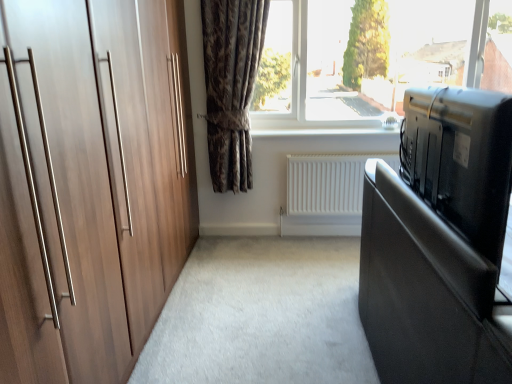
In order to click on black glossy tv at right in this screenshot , I will do `click(426, 293)`.

Find the location of `white matte radiator at center`. white matte radiator at center is located at coordinates (328, 183).

Find the location of a particular element. The width and height of the screenshot is (512, 384). black glossy tv at right is located at coordinates (426, 293).

Is dark brown textured curtain at center positioned behind white matte radiator at center?

That is False.

From a real-world perspective, is dark brown textured curtain at center on top of white matte radiator at center?

Yes.

From the image's perspective, which object appears higher, dark brown textured curtain at center or white matte radiator at center?

dark brown textured curtain at center.

From the picture: Considering the relative sizes of dark brown textured curtain at center and white matte radiator at center in the image provided, is dark brown textured curtain at center wider than white matte radiator at center?

Correct, the width of dark brown textured curtain at center exceeds that of white matte radiator at center.

From the image's perspective, who appears lower, black plastic television at right or white matte radiator at center?

white matte radiator at center is shown below in the image.

From a real-world perspective, is black plastic television at right physically located above or below white matte radiator at center?

black plastic television at right is above white matte radiator at center.

At what (x,y) coordinates should I click in order to perform the action: click on appliance lying above the white matte radiator at center (from the image's perspective). Please return your answer as a coordinate pair (x, y). Looking at the image, I should click on (461, 159).

From the image's perspective, is black plastic television at right over black glossy tv at right?

Yes.

From the picture: From a real-world perspective, who is located lower, black plastic television at right or black glossy tv at right?

black glossy tv at right is physically lower.

Can you confirm if black plastic television at right is bigger than black glossy tv at right?

No, black plastic television at right is not bigger than black glossy tv at right.

Which of these two, black plastic television at right or smooth black bed at right, stands shorter?

With less height is smooth black bed at right.

In the scene shown: Would you say black plastic television at right is a long distance from smooth black bed at right?

Yes, black plastic television at right and smooth black bed at right are quite far apart.

From the picture: From the image's perspective, is black plastic television at right located above smooth black bed at right?

Yes.

Is smooth black bed at right not within black plastic television at right?

Yes.

Is smooth black bed at right oriented towards black plastic television at right?

No, smooth black bed at right is not facing towards black plastic television at right.

From the image's perspective, which is above, smooth black bed at right or black plastic television at right?

From the image's view, black plastic television at right is above.

Is smooth black bed at right beside black plastic television at right?

smooth black bed at right and black plastic television at right are clearly separated.

Considering the sizes of objects black glossy tv at right and transparent glass window at upper center in the image provided, who is smaller, black glossy tv at right or transparent glass window at upper center?

Smaller between the two is transparent glass window at upper center.

From the image's perspective, is black glossy tv at right above transparent glass window at upper center?

Actually, black glossy tv at right appears below transparent glass window at upper center in the image.

How many degrees apart are the facing directions of black glossy tv at right and transparent glass window at upper center?

black glossy tv at right and transparent glass window at upper center are facing 90.4 degrees away from each other.

Is point (424, 231) in front of point (288, 116)?

Yes, point (424, 231) is closer to viewer.

From a real-world perspective, who is located lower, transparent glass window at upper center or dark brown textured curtain at center?

In real-world perspective, dark brown textured curtain at center is lower.

In the scene shown: Is transparent glass window at upper center turned away from dark brown textured curtain at center?

No.

Is point (467, 14) closer to viewer compared to point (207, 126)?

No, it is not.

Which object is closer to the camera taking this photo, transparent glass window at upper center or dark brown textured curtain at center?

dark brown textured curtain at center.

There is a white matte radiator at center. At what (x,y) coordinates should I click in order to perform the action: click on curtain above it (from a real-world perspective). Please return your answer as a coordinate pair (x, y). The image size is (512, 384). Looking at the image, I should click on (231, 85).

What are the coordinates of `radiator that appears below the black plastic television at right (from a real-world perspective)` in the screenshot? It's located at (328, 183).

Looking at this image, based on their spatial positions, is black plastic television at right or black glossy tv at right further from smooth black bed at right?

Based on the image, black plastic television at right appears to be further to smooth black bed at right.

Looking at this image, considering their positions, is transparent glass window at upper center positioned closer to white matte radiator at center than black plastic television at right?

Among the two, transparent glass window at upper center is located nearer to white matte radiator at center.

Estimate the real-world distances between objects in this image. Which object is closer to smooth black bed at right, dark brown textured curtain at center or black plastic television at right?

black plastic television at right.

Considering their positions, is smooth black bed at right positioned further to black glossy tv at right than black plastic television at right?

smooth black bed at right lies further to black glossy tv at right than the other object.

Considering their positions, is smooth black bed at right positioned further to transparent glass window at upper center than dark brown textured curtain at center?

smooth black bed at right is positioned further to the anchor transparent glass window at upper center.

Estimate the real-world distances between objects in this image. Which object is closer to dark brown textured curtain at center, black glossy tv at right or transparent glass window at upper center?

transparent glass window at upper center is positioned closer to the anchor dark brown textured curtain at center.

Based on their spatial positions, is smooth black bed at right or black plastic television at right further from white matte radiator at center?

black plastic television at right is positioned further to the anchor white matte radiator at center.

Which object lies further to the anchor point transparent glass window at upper center, smooth black bed at right or black glossy tv at right?

black glossy tv at right.

Locate an element on the screen. The width and height of the screenshot is (512, 384). plain positioned between black plastic television at right and transparent glass window at upper center from near to far is located at coordinates [x=261, y=316].

Where is `plain between black glossy tv at right and transparent glass window at upper center from front to back`? This screenshot has width=512, height=384. plain between black glossy tv at right and transparent glass window at upper center from front to back is located at coordinates (261, 316).

Find the location of a particular element. This screenshot has width=512, height=384. appliance between black glossy tv at right and smooth black bed at right from front to back is located at coordinates (461, 159).

What are the coordinates of `radiator located between dark brown textured curtain at center and transparent glass window at upper center in the left-right direction` in the screenshot? It's located at (328, 183).